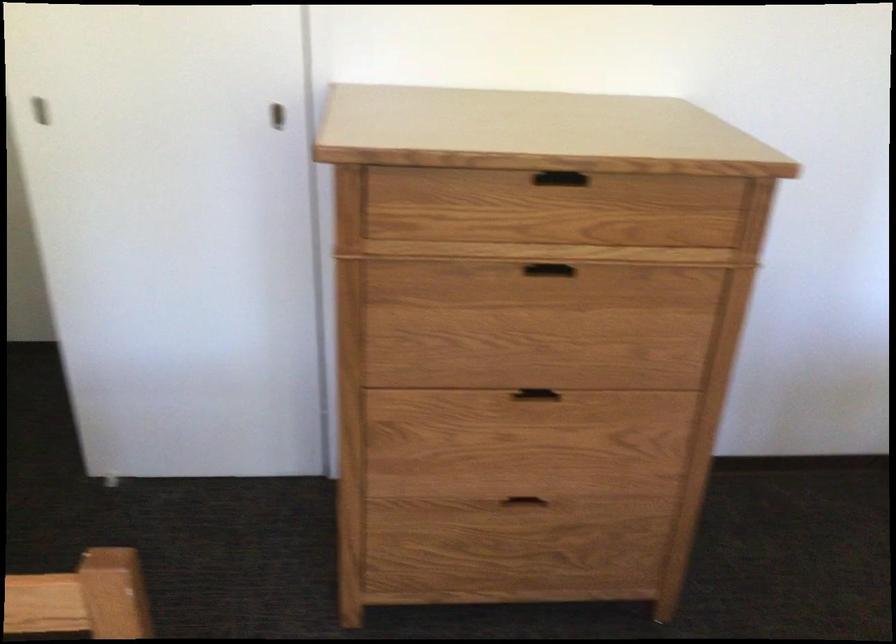
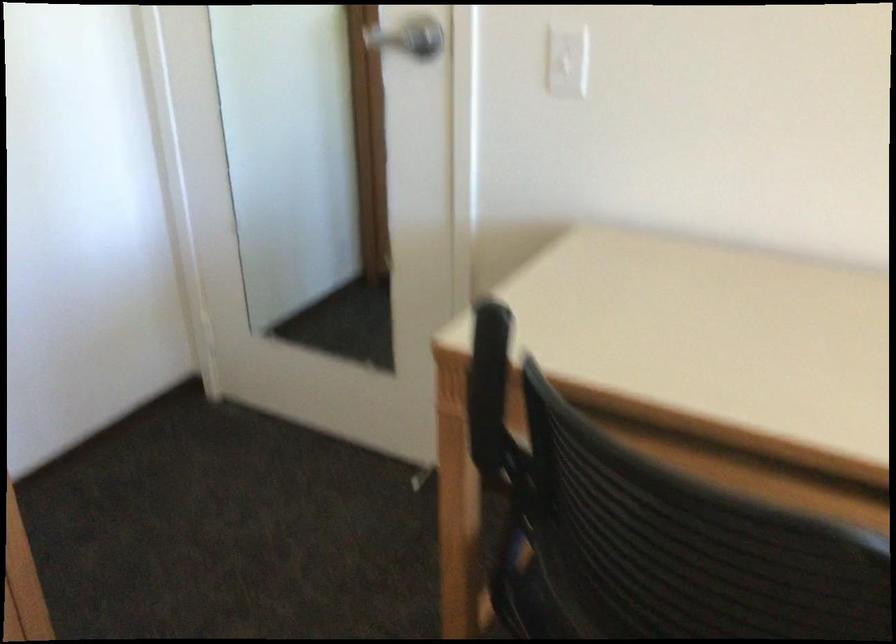
Question: Based on the continuous images, in which direction is the camera rotating? Reply with the corresponding letter.

Choices:
 (A) Left
 (B) Right
 (C) Up
 (D) Down

Answer: (B)